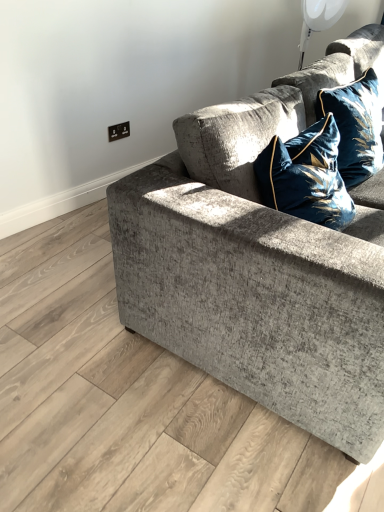
Question: Should I look upward or downward to see velvet blue pillow at upper right?

Choices:
 (A) down
 (B) up

Answer: (B)

Question: Can velvet blue pillow at upper right be found inside textured gray couch at center?

Choices:
 (A) yes
 (B) no

Answer: (A)

Question: From a real-world perspective, is textured gray couch at center physically above velvet blue pillow at upper right?

Choices:
 (A) yes
 (B) no

Answer: (B)

Question: Considering the relative sizes of textured gray couch at center and velvet blue pillow at upper right in the image provided, is textured gray couch at center smaller than velvet blue pillow at upper right?

Choices:
 (A) no
 (B) yes

Answer: (A)

Question: Is textured gray couch at center bigger than velvet blue pillow at upper right?

Choices:
 (A) no
 (B) yes

Answer: (B)

Question: Can you confirm if textured gray couch at center is positioned to the left of velvet blue pillow at upper right?

Choices:
 (A) yes
 (B) no

Answer: (B)

Question: Does textured gray couch at center have a lesser height compared to velvet blue pillow at upper right?

Choices:
 (A) yes
 (B) no

Answer: (B)

Question: From the image's perspective, is velvet blue pillow at upper right beneath textured gray couch at center?

Choices:
 (A) yes
 (B) no

Answer: (B)

Question: Does velvet blue pillow at upper right lie behind textured gray couch at center?

Choices:
 (A) yes
 (B) no

Answer: (A)

Question: Can you confirm if velvet blue pillow at upper right is thinner than textured gray couch at center?

Choices:
 (A) yes
 (B) no

Answer: (A)

Question: Can you confirm if velvet blue pillow at upper right is shorter than textured gray couch at center?

Choices:
 (A) yes
 (B) no

Answer: (A)

Question: From the image's perspective, is velvet blue pillow at upper right on top of textured gray couch at center?

Choices:
 (A) yes
 (B) no

Answer: (A)

Question: Is velvet blue pillow at upper right facing away from textured gray couch at center?

Choices:
 (A) no
 (B) yes

Answer: (B)

Question: Relative to velvet blue pillow at upper right, is textured gray couch at center in front or behind?

Choices:
 (A) front
 (B) behind

Answer: (A)